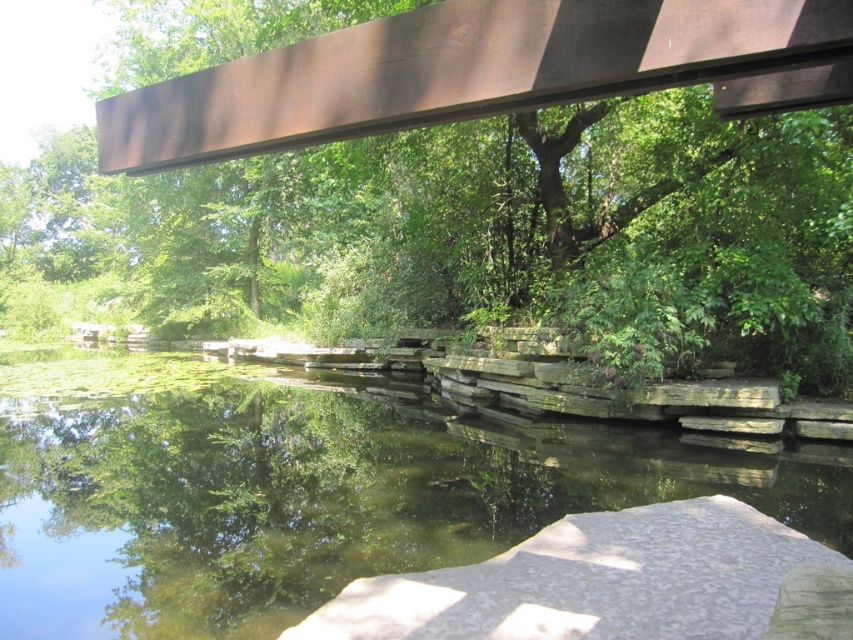
Who is lower down, rusty metal beam at upper center or gray/granite rock at lower center?

gray/granite rock at lower center

Is rusty metal beam at upper center shorter than gray/granite rock at lower center?

In fact, rusty metal beam at upper center may be taller than gray/granite rock at lower center.

Who is more distant from viewer, (x=215, y=248) or (x=715, y=550)?

The point (x=215, y=248) is more distant.

Identify the location of rusty metal beam at upper center. This screenshot has height=640, width=853. (486, 230).

Is greenish stone river at center thinner than gray/granite rock at lower center?

No.

Does greenish stone river at center appear on the left side of gray/granite rock at lower center?

Indeed, greenish stone river at center is positioned on the left side of gray/granite rock at lower center.

Identify the location of greenish stone river at center. The height and width of the screenshot is (640, 853). (300, 490).

Looking at this image, which is above, rusty metal beam at upper center or greenish stone river at center?

Positioned higher is rusty metal beam at upper center.

Does rusty metal beam at upper center appear on the left side of greenish stone river at center?

Indeed, rusty metal beam at upper center is positioned on the left side of greenish stone river at center.

What do you see at coordinates (486, 230) in the screenshot?
I see `rusty metal beam at upper center` at bounding box center [486, 230].

Where is `rusty metal beam at upper center`? The width and height of the screenshot is (853, 640). rusty metal beam at upper center is located at coordinates (486, 230).